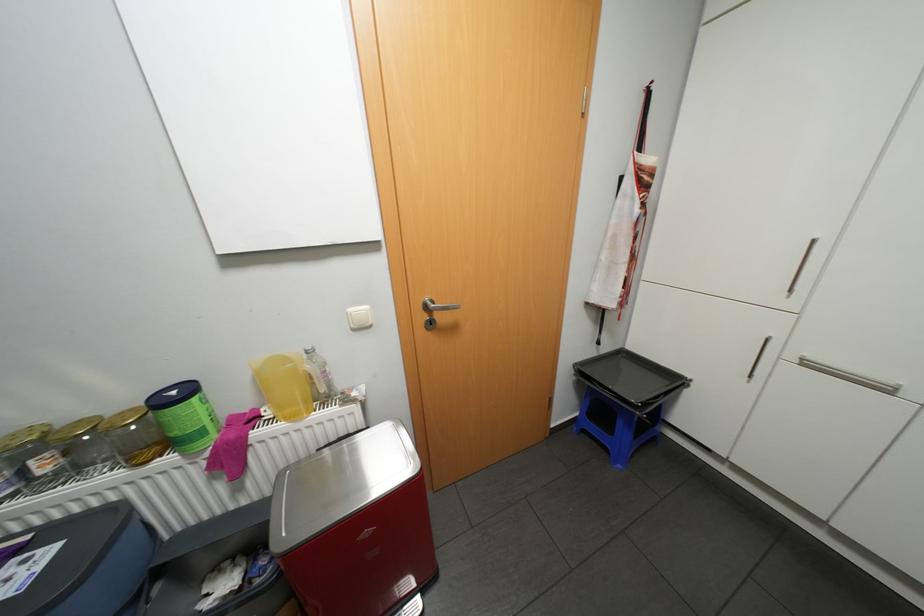
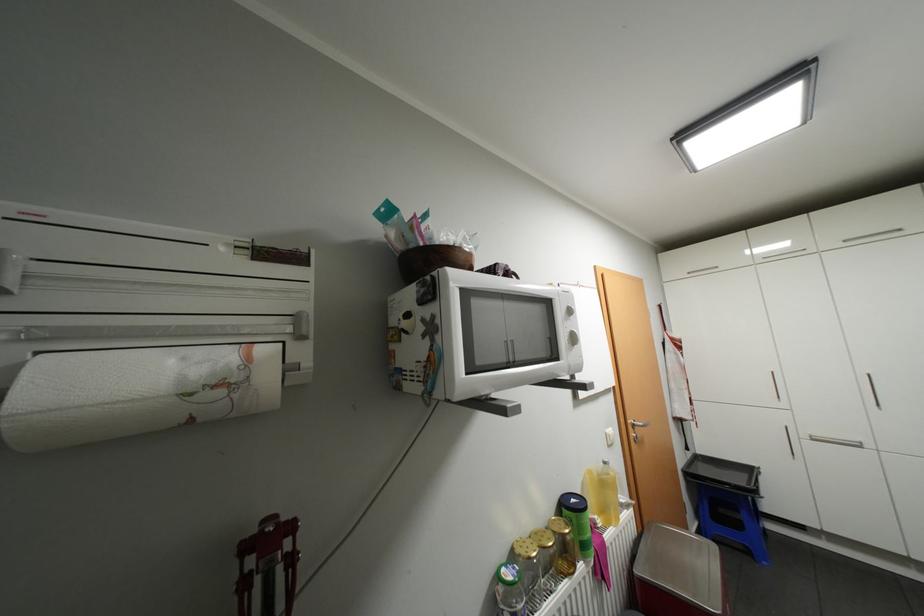
In the second image, find the point that corresponds to (x=275, y=413) in the first image.

(606, 521)